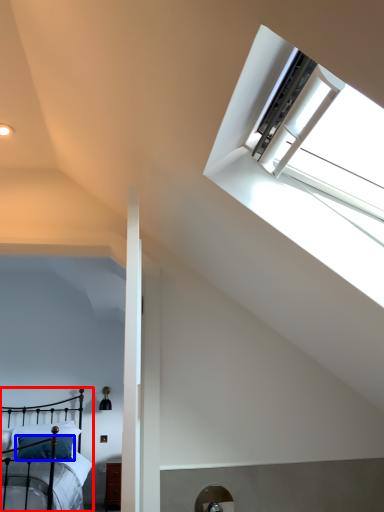
Question: Among these objects, which one is nearest to the camera, bed (highlighted by a red box) or pillow (highlighted by a blue box)?

Choices:
 (A) bed
 (B) pillow

Answer: (A)